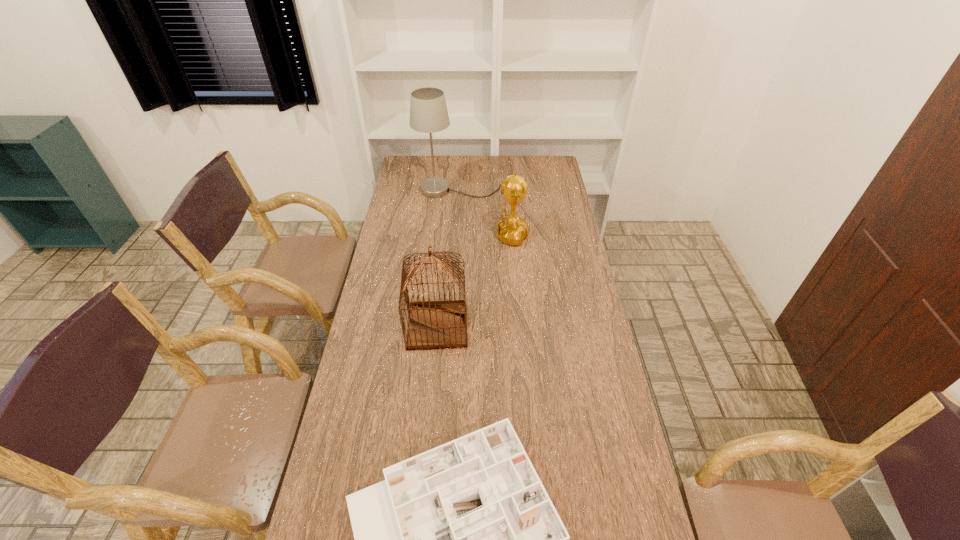
Where is `the tallest object`? the tallest object is located at coordinates (428, 111).

I want to click on the farthest object, so click(428, 111).

Find the location of a particular element. The image size is (960, 540). birdcage is located at coordinates (x=433, y=325).

What are the coordinates of `the third farthest object` in the screenshot? It's located at (433, 325).

At what (x,y) coordinates should I click in order to perform the action: click on the second farthest object. Please return your answer as a coordinate pair (x, y). The height and width of the screenshot is (540, 960). Looking at the image, I should click on (512, 230).

Locate an element on the screen. This screenshot has height=540, width=960. the second shortest object is located at coordinates click(512, 230).

Locate an element on the screen. The height and width of the screenshot is (540, 960). free space located on the front of the table lamp is located at coordinates (456, 237).

This screenshot has width=960, height=540. I want to click on vacant space positioned on the front of the second tallest object, so click(x=431, y=390).

The height and width of the screenshot is (540, 960). I want to click on vacant space positioned 0.150m on the front side of the award, so click(x=449, y=235).

Locate an element on the screen. free location located on the front side of the award is located at coordinates (472, 235).